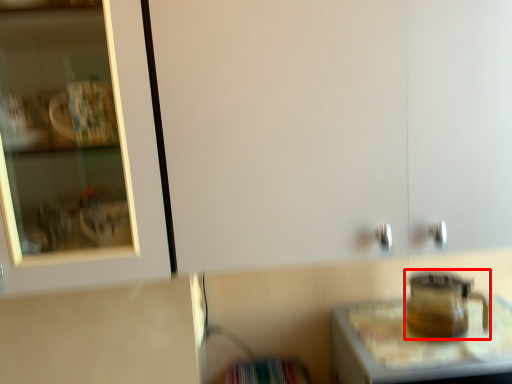
Question: From the image's perspective, what is the correct spatial relationship of appliance (annotated by the red box) in relation to table?

Choices:
 (A) above
 (B) below

Answer: (A)